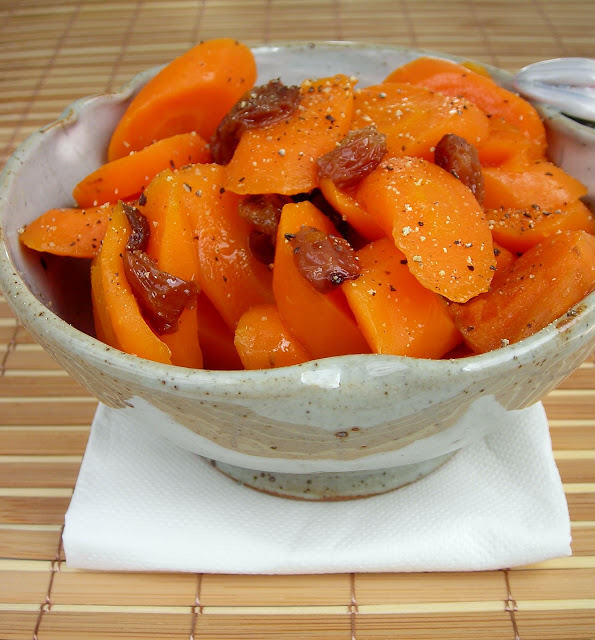
Identify the location of bamboo placemat. (300, 607), (317, 20).